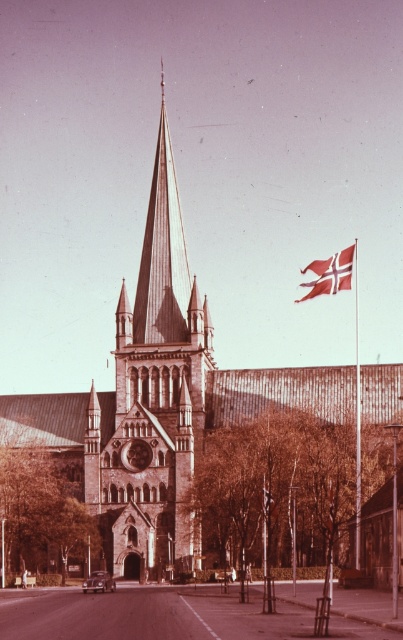
You are a window cleaner standing at the base of the church spire. You need to clean both the white fabric flag at upper right and the metallic flagpole at right. Given that your ladder can extend up to 25 feet, can you safely reach both objects with the ladder?

The distance between the white fabric flag at upper right and the metallic flagpole at right is 27.82 feet. Since your ladder only extends up to 25 feet, you cannot safely reach both objects with the ladder.

You are a photographer standing on the street in front of the church. You want to capture a photo that includes both the brown stone tower at center and the white fabric flag at upper right. Which object will appear larger in your photo?

The brown stone tower at center will appear larger in the photo because it is taller than the white fabric flag at upper right.

You are a photographer planning to take a picture of the church from the street below. You want to ensure the white fabric flag at upper right and the metallic flagpole at right are both visible in the frame. Given their sizes, which object might appear smaller in the photo?

The white fabric flag at upper right is shorter than the metallic flagpole at right, so it would appear smaller in the photo.